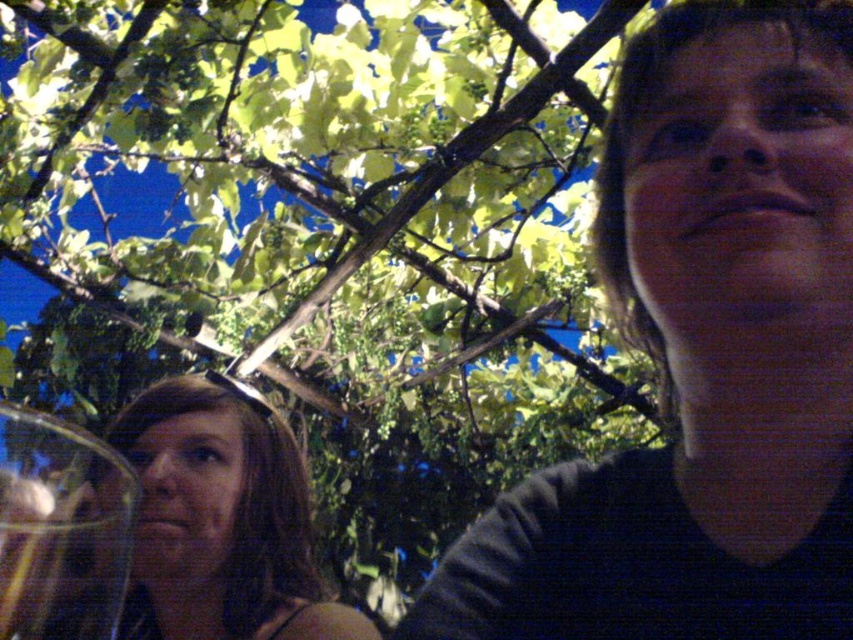
Is dark gray sweater at upper right wider than transparent glass at left?

Yes.

Consider the image. Can you confirm if dark gray sweater at upper right is bigger than transparent glass at left?

Indeed, dark gray sweater at upper right has a larger size compared to transparent glass at left.

Which is in front, point (654, 173) or point (126, 547)?

Point (126, 547) is in front.

Where is `dark gray sweater at upper right`? This screenshot has height=640, width=853. dark gray sweater at upper right is located at coordinates (701, 358).

Which is below, matte brown hair at center or transparent glass at left?

Positioned lower is matte brown hair at center.

Describe the element at coordinates (221, 522) in the screenshot. I see `matte brown hair at center` at that location.

Between point (170, 538) and point (131, 496), which one is positioned behind?

Point (170, 538)

Where is `matte brown hair at center`? This screenshot has height=640, width=853. matte brown hair at center is located at coordinates (221, 522).

Is dark gray sweater at upper right to the left of matte brown hair at center from the viewer's perspective?

Incorrect, dark gray sweater at upper right is not on the left side of matte brown hair at center.

Image resolution: width=853 pixels, height=640 pixels. Describe the element at coordinates (701, 358) in the screenshot. I see `dark gray sweater at upper right` at that location.

This screenshot has height=640, width=853. What are the coordinates of `dark gray sweater at upper right` in the screenshot? It's located at (701, 358).

You are a GUI agent. You are given a task and a screenshot of the screen. Output one action in this format:
    pyautogui.click(x=<x>, y=<y>)
    Task: Click on the dark gray sweater at upper right
    The width and height of the screenshot is (853, 640).
    Given the screenshot: What is the action you would take?
    point(701,358)